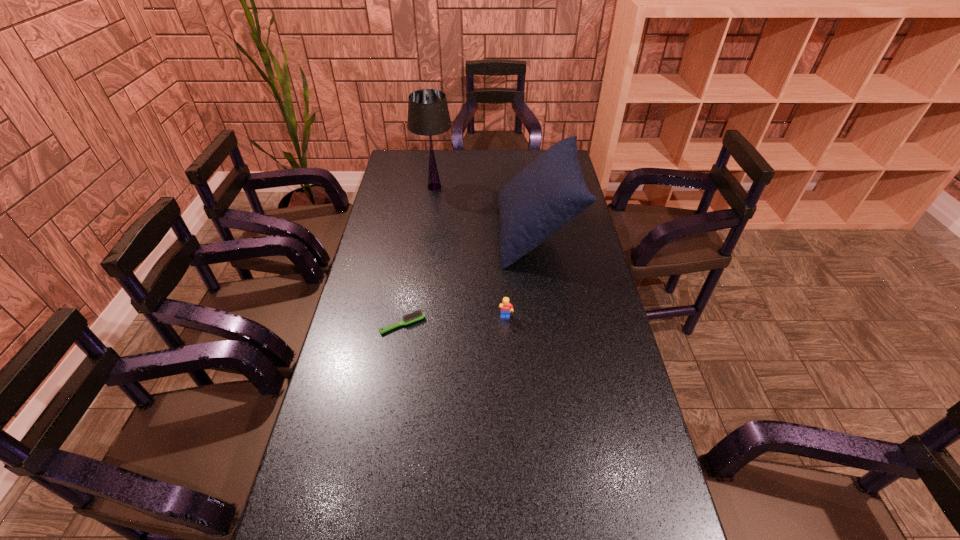
The width and height of the screenshot is (960, 540). In order to click on free space between the farthest object and the second tallest object in this screenshot , I will do `click(485, 210)`.

This screenshot has width=960, height=540. What are the coordinates of `empty space between the cushion and the shortest object` in the screenshot? It's located at (469, 279).

You are a GUI agent. You are given a task and a screenshot of the screen. Output one action in this format:
    pyautogui.click(x=<x>, y=<y>)
    Task: Click on the free space between the second shortest object and the hairbrush
    This screenshot has height=540, width=960.
    Given the screenshot: What is the action you would take?
    (454, 321)

The width and height of the screenshot is (960, 540). I want to click on free space that is in between the hairbrush and the second tallest object, so click(x=469, y=279).

The image size is (960, 540). I want to click on free space between the cushion and the third tallest object, so click(x=521, y=275).

Locate an element on the screen. This screenshot has height=540, width=960. free point between the hairbrush and the Lego is located at coordinates (454, 321).

Locate an element on the screen. The width and height of the screenshot is (960, 540). the closest object relative to the Lego is located at coordinates [x=550, y=192].

Select which object appears as the closest to the third shortest object. Please provide its 2D coordinates. Your answer should be formatted as a tuple, i.e. [(x, y)], where the tuple contains the x and y coordinates of a point satisfying the conditions above.

[(428, 114)]

This screenshot has width=960, height=540. What are the coordinates of `free space that satisfies the following two spatial constraints: 1. on the facing side of the second tallest object; 2. on the front side of the shortest object` in the screenshot? It's located at 549,325.

This screenshot has height=540, width=960. I want to click on vacant area in the image that satisfies the following two spatial constraints: 1. on the facing side of the cushion; 2. on the face of the Lego, so click(548, 318).